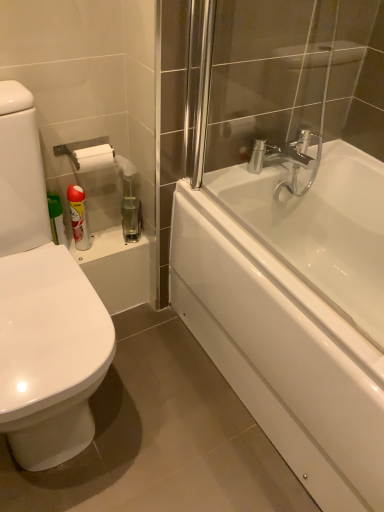
Question: In terms of size, does white glossy bathtub at right appear bigger or smaller than translucent plastic spray bottle at upper left?

Choices:
 (A) big
 (B) small

Answer: (A)

Question: Considering the positions of white glossy bathtub at right and translucent plastic spray bottle at upper left in the image, is white glossy bathtub at right wider or thinner than translucent plastic spray bottle at upper left?

Choices:
 (A) wide
 (B) thin

Answer: (B)

Question: Considering the real-world distances, which object is farthest from the white glossy bathtub at right?

Choices:
 (A) clear glass shower door at upper right
 (B) white glossy can at upper left
 (C) translucent plastic spray bottle at upper left
 (D) white glossy bathtub at right

Answer: (B)

Question: Considering the real-world distances, which object is closest to the white glossy bathtub at right?

Choices:
 (A) translucent plastic spray bottle at upper left
 (B) white glossy bathtub at right
 (C) white glossy can at upper left
 (D) clear glass shower door at upper right

Answer: (B)